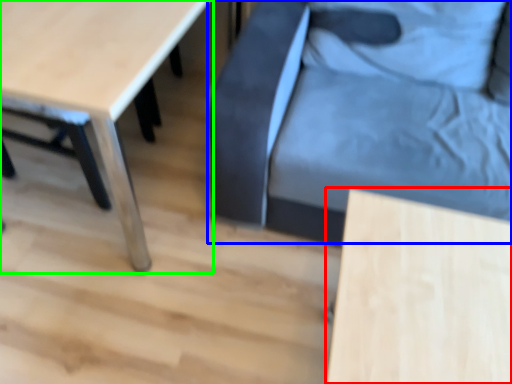
Question: Estimate the real-world distances between objects in this image. Which object is closer to table (highlighted by a red box), swivel chair (highlighted by a blue box) or table (highlighted by a green box)?

Choices:
 (A) swivel chair
 (B) table

Answer: (A)